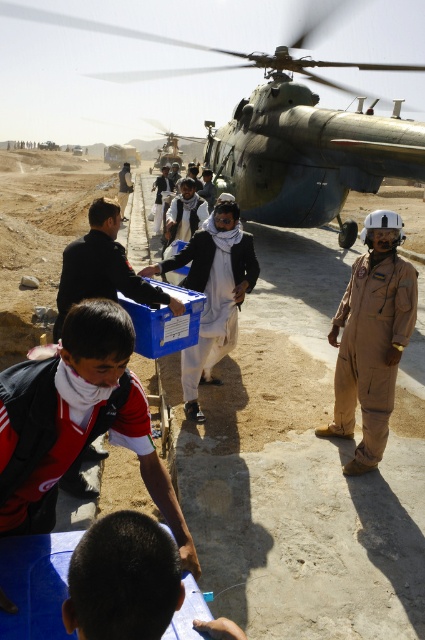
Question: Can you confirm if blue plastic box at center is wider than light brown fabric jacket at center?

Choices:
 (A) yes
 (B) no

Answer: (B)

Question: Which object is the closest to the tan jumpsuit at right?

Choices:
 (A) green matte helicopter at center
 (B) matte black shirt at center

Answer: (B)

Question: Estimate the real-world distances between objects in this image. Which object is farther from the red shirt at center?

Choices:
 (A) green matte helicopter at center
 (B) brown hair at lower center
 (C) metallic gray helicopter at upper center
 (D) blue plastic box at center

Answer: (A)

Question: Which point is farther to the camera?

Choices:
 (A) (59, 390)
 (B) (161, 211)
 (C) (82, 486)

Answer: (B)

Question: Where is tan jumpsuit at right located in relation to light brown fabric jacket at center in the image?

Choices:
 (A) below
 (B) above

Answer: (A)

Question: Is brown hair at lower center smaller than light brown fabric shirt at center?

Choices:
 (A) no
 (B) yes

Answer: (B)